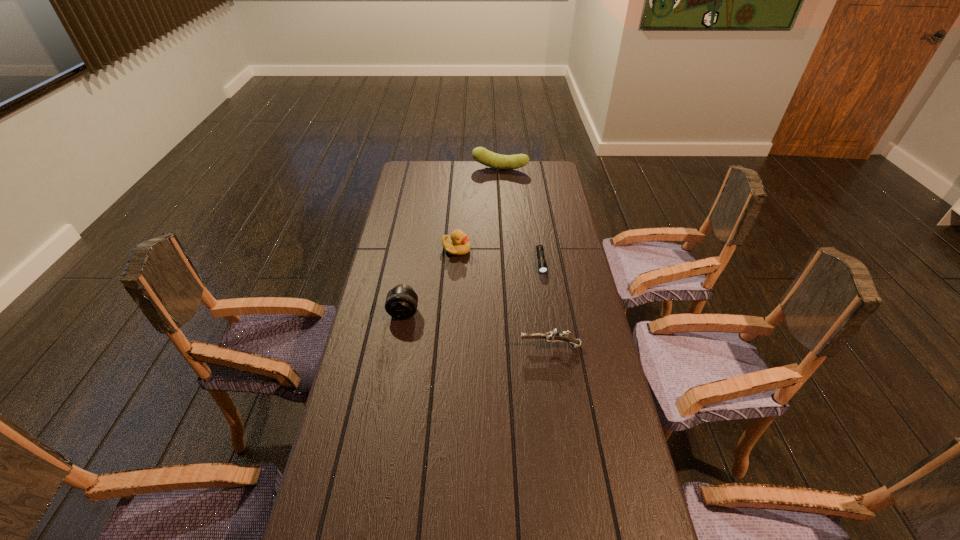
At what (x,y) coordinates should I click in order to perform the action: click on cucumber. Please return your answer as a coordinate pair (x, y). Looking at the image, I should click on (488, 158).

I want to click on the second nearest object, so click(401, 302).

Where is `telephoto lens`? The height and width of the screenshot is (540, 960). telephoto lens is located at coordinates (401, 302).

Find the location of a particular element. duckling is located at coordinates (457, 244).

Image resolution: width=960 pixels, height=540 pixels. Identify the location of the nearest object. (553, 337).

Identify the location of gun. (553, 337).

The image size is (960, 540). I want to click on the shortest object, so click(x=542, y=265).

Where is `vacant space located 0.150m on the front of the cucumber`? vacant space located 0.150m on the front of the cucumber is located at coordinates (501, 191).

Identify the location of vacant space located on the front-facing side of the telephoto lens. This screenshot has height=540, width=960. (383, 434).

You are a GUI agent. You are given a task and a screenshot of the screen. Output one action in this format:
    pyautogui.click(x=<x>, y=<y>)
    Task: Click on the free space located on the beak of the duckling
    The width and height of the screenshot is (960, 540).
    Given the screenshot: What is the action you would take?
    pyautogui.click(x=512, y=249)